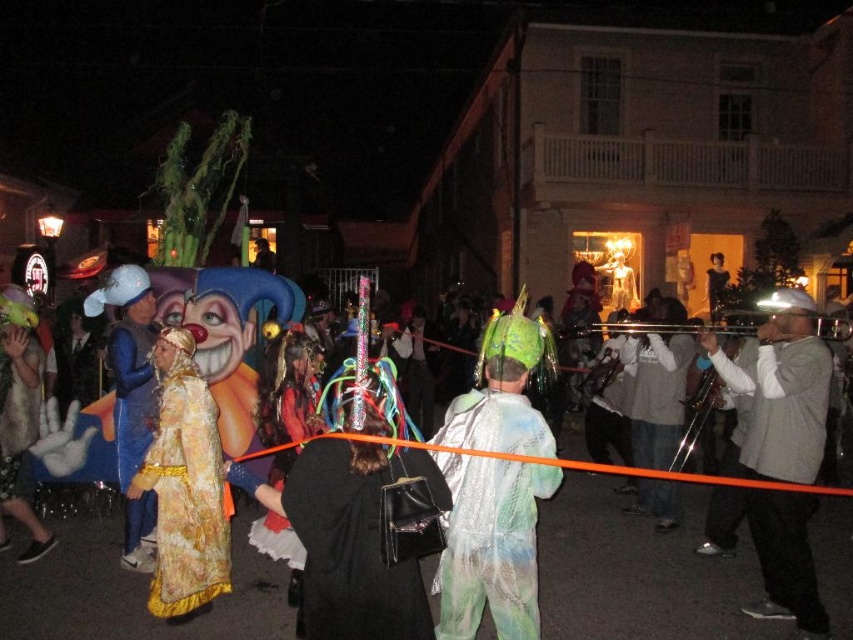
Between shiny silver sequins at center and blue velvet mask at left, which one has less height?

shiny silver sequins at center

Which of these two, shiny silver sequins at center or blue velvet mask at left, stands taller?

blue velvet mask at left

Between point (473, 534) and point (148, 522), which one is positioned in front?

Point (473, 534) is more forward.

The image size is (853, 640). Find the location of `shiny silver sequins at center`. shiny silver sequins at center is located at coordinates (490, 545).

Between shiny metallic clown at center and velvet gold dress at center, which one is positioned lower?

shiny metallic clown at center

Is shiny metallic clown at center shorter than velvet gold dress at center?

Yes, shiny metallic clown at center is shorter than velvet gold dress at center.

Where is `shiny metallic clown at center`? shiny metallic clown at center is located at coordinates (636, 572).

Is white cotton shirt at center shorter than velvet gold dress at center?

In fact, white cotton shirt at center may be taller than velvet gold dress at center.

Can you confirm if white cotton shirt at center is positioned to the left of velvet gold dress at center?

No, white cotton shirt at center is not to the left of velvet gold dress at center.

Between point (683, 376) and point (293, 422), which one is positioned in front?

Positioned in front is point (293, 422).

Where is `white cotton shirt at center`? Image resolution: width=853 pixels, height=640 pixels. white cotton shirt at center is located at coordinates (656, 396).